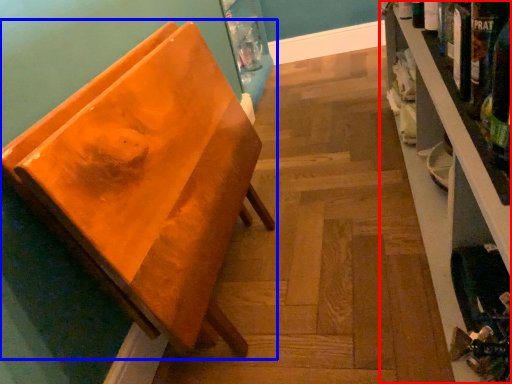
Question: Which of the following is the farthest to the observer, shelf (highlighted by a red box) or furniture (highlighted by a blue box)?

Choices:
 (A) shelf
 (B) furniture

Answer: (B)